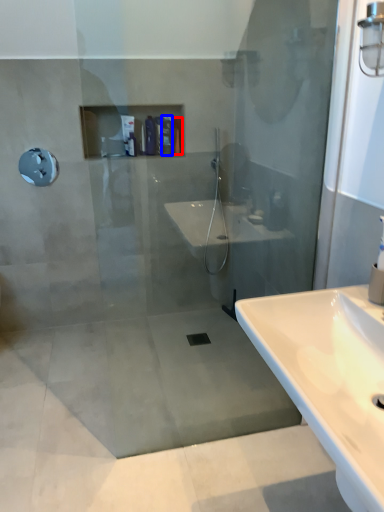
Question: Which of the following is the closest to the observer, toiletry (highlighted by a red box) or toiletry (highlighted by a blue box)?

Choices:
 (A) toiletry
 (B) toiletry

Answer: (B)